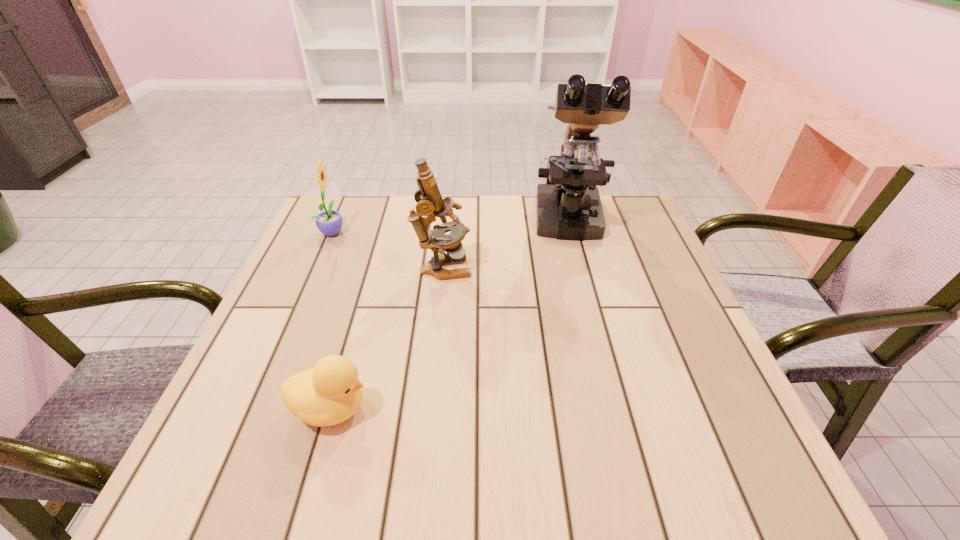
I want to click on the right microscope, so click(x=568, y=207).

In order to click on the taller microscope in this screenshot , I will do `click(568, 207)`.

Find the location of `the second nearest object`. the second nearest object is located at coordinates (429, 201).

The image size is (960, 540). What are the coordinates of `the shorter microscope` in the screenshot? It's located at (429, 201).

Image resolution: width=960 pixels, height=540 pixels. Identify the location of sunflower. (329, 222).

Find the location of a particular element. The height and width of the screenshot is (540, 960). the leftmost object is located at coordinates (329, 222).

The image size is (960, 540). Identify the location of the shortest object. (330, 393).

Where is `the third object from right to left`? the third object from right to left is located at coordinates (330, 393).

Find the location of `free space located on the left of the taller microscope`. free space located on the left of the taller microscope is located at coordinates (483, 222).

You are a GUI agent. You are given a task and a screenshot of the screen. Output one action in this format:
    pyautogui.click(x=<x>, y=<y>)
    Task: Click on the free point located 0.360m on the front of the third farthest object
    This screenshot has height=540, width=960.
    Given the screenshot: What is the action you would take?
    pyautogui.click(x=427, y=427)